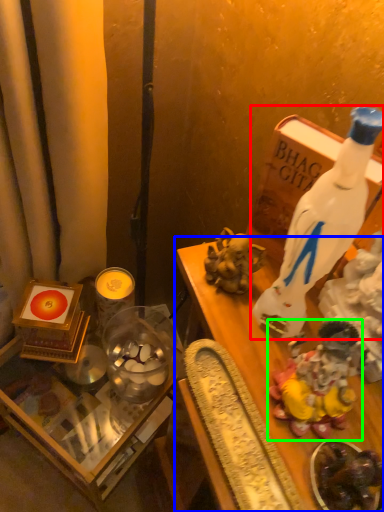
Question: Which object is the farthest from bottle (highlighted by a red box)? Choose among these: furniture (highlighted by a blue box) or toy (highlighted by a green box).

Choices:
 (A) furniture
 (B) toy

Answer: (B)